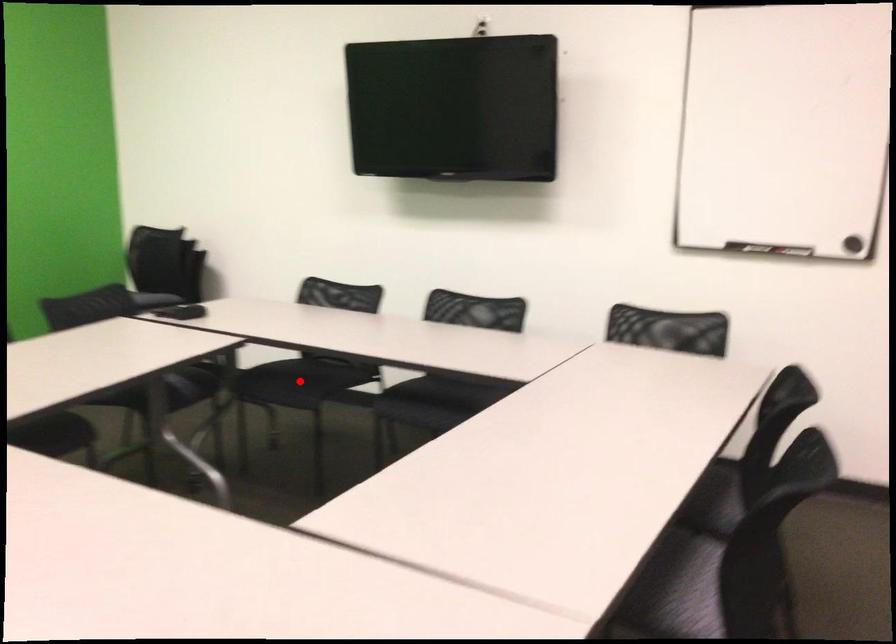
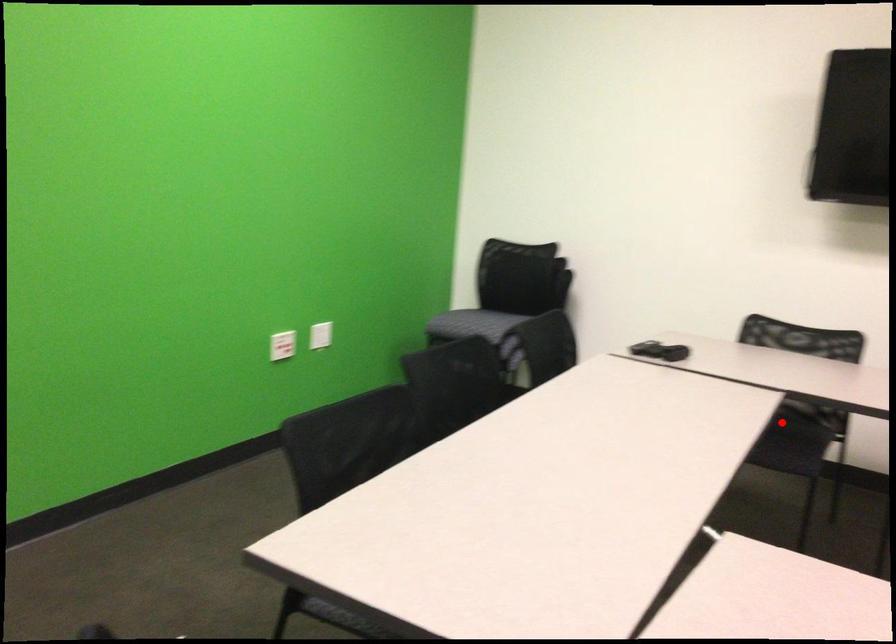
I am providing you with two images of the same scene from different viewpoints. A red point is marked on the first image and another point is marked on the second image. Is the marked point in image1 the same physical position as the marked point in image2?

Yes